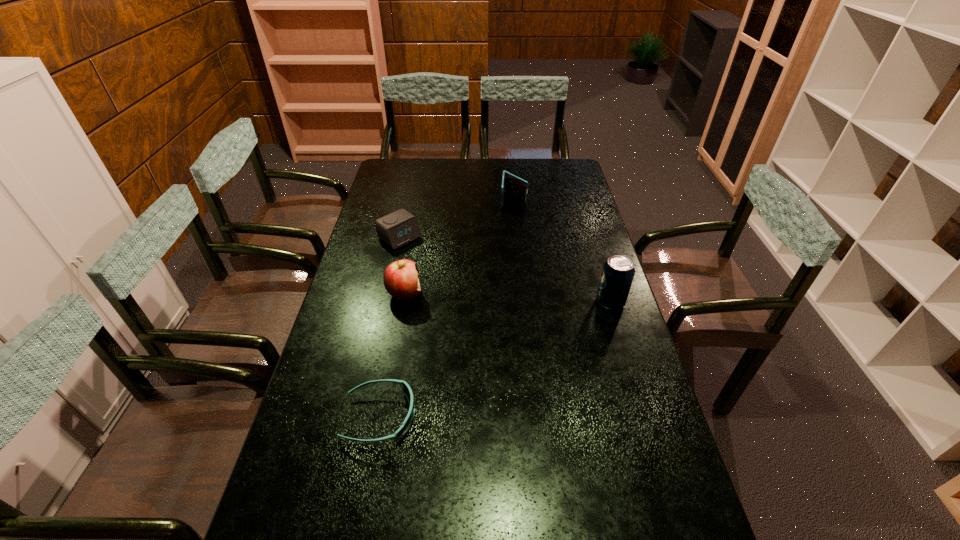
Where is `free spot between the apple and the third tallest object`? Image resolution: width=960 pixels, height=540 pixels. free spot between the apple and the third tallest object is located at coordinates (459, 247).

You are a GUI agent. You are given a task and a screenshot of the screen. Output one action in this format:
    pyautogui.click(x=<x>, y=<y>)
    Task: Click on the vacant area between the fourth nearest object and the shortest object
    This screenshot has height=540, width=960.
    Given the screenshot: What is the action you would take?
    pyautogui.click(x=390, y=327)

Image resolution: width=960 pixels, height=540 pixels. What are the coordinates of `blank region between the sunglasses and the apple` in the screenshot? It's located at click(393, 355).

Where is `free space that is in between the sunglasses and the tallest object`? free space that is in between the sunglasses and the tallest object is located at coordinates (495, 360).

You are a GUI agent. You are given a task and a screenshot of the screen. Output one action in this format:
    pyautogui.click(x=<x>, y=<y>)
    Task: Click on the vacant region between the shortest object and the rightmost object
    This screenshot has height=540, width=960.
    Given the screenshot: What is the action you would take?
    pyautogui.click(x=495, y=360)

Identify the location of empty space that is in between the fourth nearest object and the wallet. Image resolution: width=960 pixels, height=540 pixels. (456, 219).

What are the coordinates of `free space between the third shortest object and the apple` in the screenshot? It's located at (459, 247).

In order to click on free space between the tallest object and the second object from right to left in this screenshot , I will do `click(562, 252)`.

At what (x,y) coordinates should I click in order to perform the action: click on object that is the second closest to the wallet. Please return your answer as a coordinate pair (x, y). This screenshot has width=960, height=540. Looking at the image, I should click on (400, 278).

You are a GUI agent. You are given a task and a screenshot of the screen. Output one action in this format:
    pyautogui.click(x=<x>, y=<y>)
    Task: Click on the object that is the closest to the second object from right to left
    
    Given the screenshot: What is the action you would take?
    pyautogui.click(x=396, y=229)